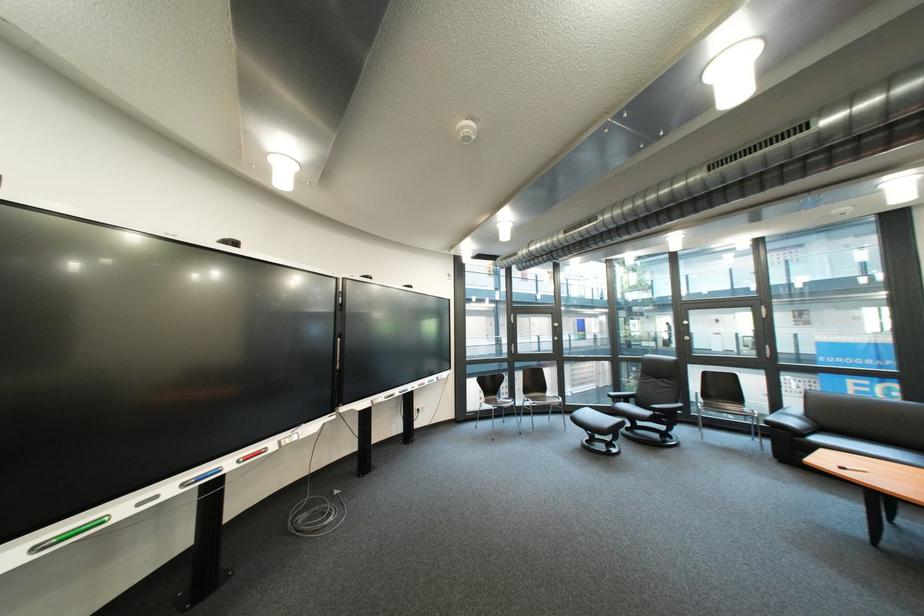
Describe the element at coordinates (874, 419) in the screenshot. I see `the sofa sitting surface` at that location.